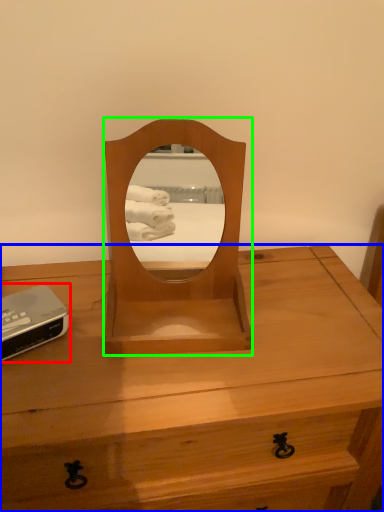
Question: Which is farther away from gadget (highlighted by a red box)? desk (highlighted by a blue box) or mirror (highlighted by a green box)?

Choices:
 (A) desk
 (B) mirror

Answer: (A)